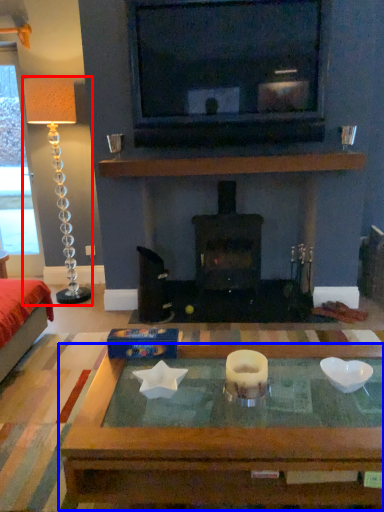
Question: Which object is further to the camera taking this photo, lamp (highlighted by a red box) or coffee table (highlighted by a blue box)?

Choices:
 (A) lamp
 (B) coffee table

Answer: (A)